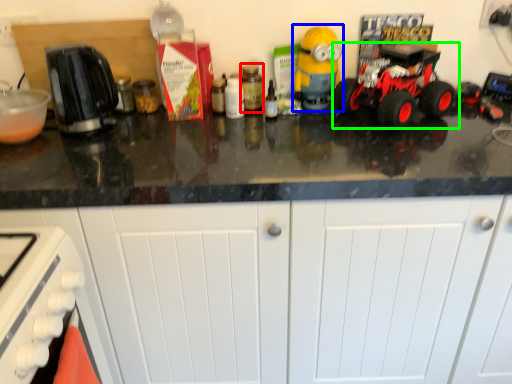
Question: Considering the real-world distances, which object is closest to bottle (highlighted by a red box)? toy (highlighted by a blue box) or land vehicle (highlighted by a green box).

Choices:
 (A) toy
 (B) land vehicle

Answer: (A)